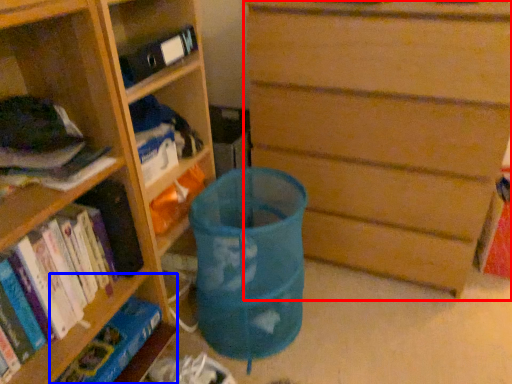
Question: Which of the following is the closest to the observer, chest of drawers (highlighted by a red box) or shelf (highlighted by a blue box)?

Choices:
 (A) chest of drawers
 (B) shelf

Answer: (A)